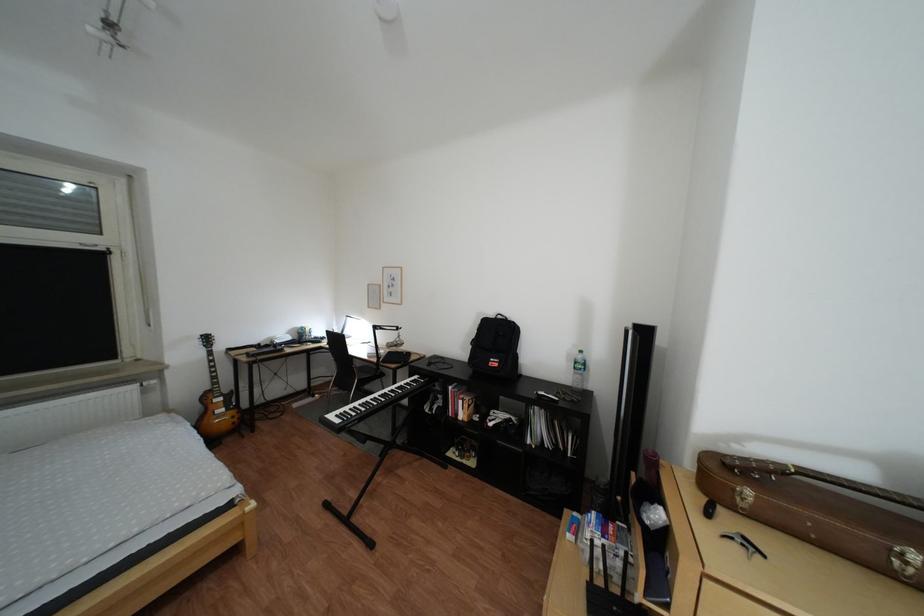
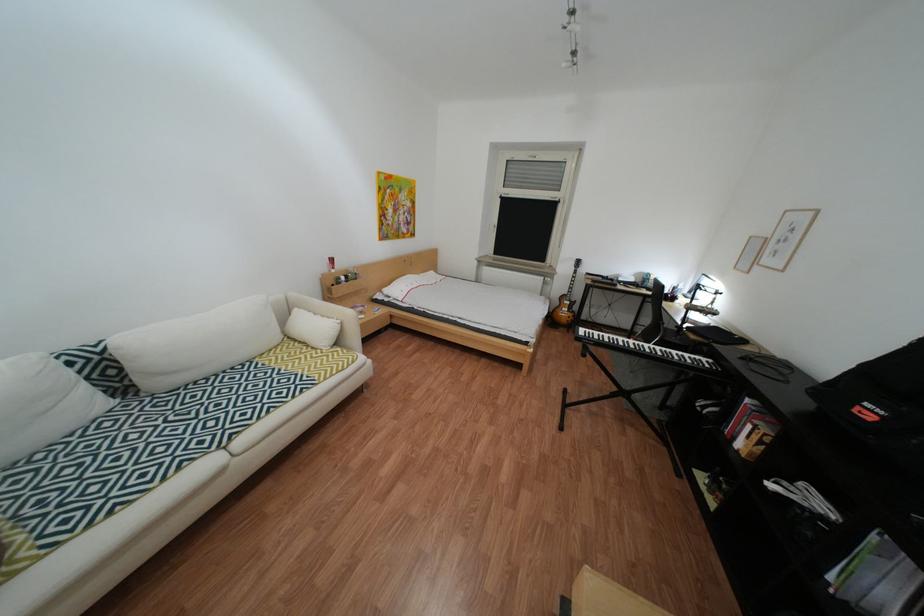
The point at (512, 366) is marked in the first image. Where is the corresponding point in the second image?

(886, 419)